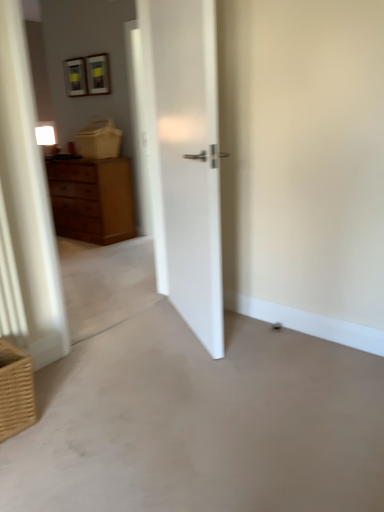
What do you see at coordinates (15, 391) in the screenshot? I see `brown woven basket at lower left` at bounding box center [15, 391].

At what (x,y) coordinates should I click in order to perform the action: click on wooden chest of drawers at left. Please return your answer as a coordinate pair (x, y). The image size is (384, 512). Looking at the image, I should click on (92, 199).

Which object is closer to the camera taking this photo, brown woven basket at lower left or smooth concrete floor at center?

smooth concrete floor at center.

From the image's perspective, which one is positioned higher, brown woven basket at lower left or smooth concrete floor at center?

brown woven basket at lower left appears higher in the image.

Is brown woven basket at lower left shorter than smooth concrete floor at center?

In fact, brown woven basket at lower left may be taller than smooth concrete floor at center.

Measure the distance from brown woven basket at lower left to smooth concrete floor at center.

They are 22.04 inches apart.

From a real-world perspective, which is physically above, wooden chest of drawers at left or brown woven basket at lower left?

wooden chest of drawers at left.

In the image, is wooden chest of drawers at left positioned in front of or behind brown woven basket at lower left?

Clearly, wooden chest of drawers at left is behind brown woven basket at lower left.

Is wooden chest of drawers at left in contact with brown woven basket at lower left?

wooden chest of drawers at left and brown woven basket at lower left are not in contact.

Does wooden chest of drawers at left have a greater height compared to brown woven basket at lower left?

Indeed, wooden chest of drawers at left has a greater height compared to brown woven basket at lower left.

Is smooth concrete floor at center oriented away from wooden chest of drawers at left?

smooth concrete floor at center is not turned away from wooden chest of drawers at left.

Which of these two, smooth concrete floor at center or wooden chest of drawers at left, is wider?

smooth concrete floor at center is wider.

Visually, is smooth concrete floor at center positioned to the left or to the right of wooden chest of drawers at left?

smooth concrete floor at center is to the right of wooden chest of drawers at left.

From a real-world perspective, is smooth concrete floor at center positioned above or below wooden chest of drawers at left?

From a real-world perspective, smooth concrete floor at center is physically below wooden chest of drawers at left.

Would you consider brown woven basket at lower left to be distant from wooden chest of drawers at left?

brown woven basket at lower left is positioned a significant distance from wooden chest of drawers at left.

From the image's perspective, is brown woven basket at lower left beneath wooden chest of drawers at left?

Yes.

Considering the positions of objects brown woven basket at lower left and wooden chest of drawers at left in the image provided, who is more to the right, brown woven basket at lower left or wooden chest of drawers at left?

brown woven basket at lower left.

From the image's perspective, which is above, smooth concrete floor at center or brown woven basket at lower left?

brown woven basket at lower left is shown above in the image.

From a real-world perspective, does smooth concrete floor at center stand above brown woven basket at lower left?

Incorrect, from a real-world perspective, smooth concrete floor at center is lower than brown woven basket at lower left.

Would you say smooth concrete floor at center is a long distance from brown woven basket at lower left?

smooth concrete floor at center is actually quite close to brown woven basket at lower left.

Considering the relative sizes of smooth concrete floor at center and brown woven basket at lower left in the image provided, is smooth concrete floor at center taller than brown woven basket at lower left?

No.

Find the location of a particular element. concrete lying in front of the wooden chest of drawers at left is located at coordinates (201, 424).

Considering the relative sizes of wooden chest of drawers at left and smooth concrete floor at center in the image provided, is wooden chest of drawers at left taller than smooth concrete floor at center?

Indeed, wooden chest of drawers at left has a greater height compared to smooth concrete floor at center.

From the image's perspective, which one is positioned higher, wooden chest of drawers at left or smooth concrete floor at center?

wooden chest of drawers at left, from the image's perspective.

Can we say wooden chest of drawers at left lies outside smooth concrete floor at center?

That's correct, wooden chest of drawers at left is outside of smooth concrete floor at center.

Find the location of a particular element. The height and width of the screenshot is (512, 384). basket lying on the left of smooth concrete floor at center is located at coordinates (15, 391).

I want to click on chest of drawers above the brown woven basket at lower left (from a real-world perspective), so click(x=92, y=199).

From the image, which object appears to be farther from smooth concrete floor at center, brown woven basket at lower left or wooden chest of drawers at left?

Among the two, wooden chest of drawers at left is located further to smooth concrete floor at center.

When comparing their distances from wooden chest of drawers at left, does smooth concrete floor at center or brown woven basket at lower left seem further?

brown woven basket at lower left lies further to wooden chest of drawers at left than the other object.

Estimate the real-world distances between objects in this image. Which object is further from smooth concrete floor at center, wooden chest of drawers at left or brown woven basket at lower left?

Based on the image, wooden chest of drawers at left appears to be further to smooth concrete floor at center.

From the image, which object appears to be nearer to wooden chest of drawers at left, brown woven basket at lower left or smooth concrete floor at center?

smooth concrete floor at center is positioned closer to the anchor wooden chest of drawers at left.

Which object lies further to the anchor point brown woven basket at lower left, smooth concrete floor at center or wooden chest of drawers at left?

Among the two, wooden chest of drawers at left is located further to brown woven basket at lower left.

From the image, which object appears to be nearer to brown woven basket at lower left, wooden chest of drawers at left or smooth concrete floor at center?

smooth concrete floor at center.

The height and width of the screenshot is (512, 384). I want to click on basket between smooth concrete floor at center and wooden chest of drawers at left along the z-axis, so click(15, 391).